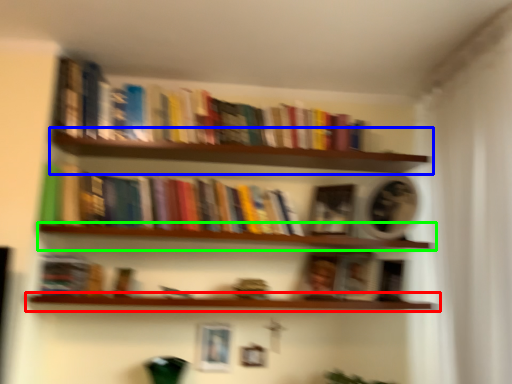
Question: Considering the real-world distances, which object is farthest from window sill (highlighted by a red box)? shelf (highlighted by a blue box) or window sill (highlighted by a green box)?

Choices:
 (A) shelf
 (B) window sill

Answer: (A)